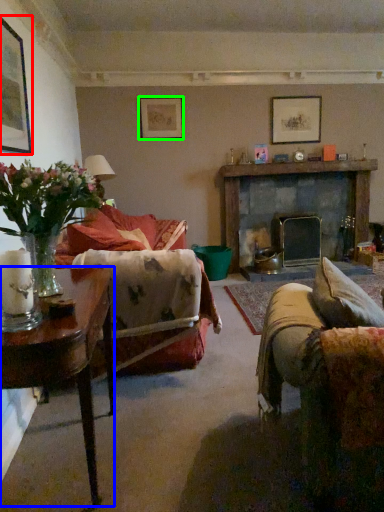
Question: Estimate the real-world distances between objects in this image. Which object is closer to picture frame (highlighted by a red box), table (highlighted by a blue box) or picture frame (highlighted by a green box)?

Choices:
 (A) table
 (B) picture frame

Answer: (A)